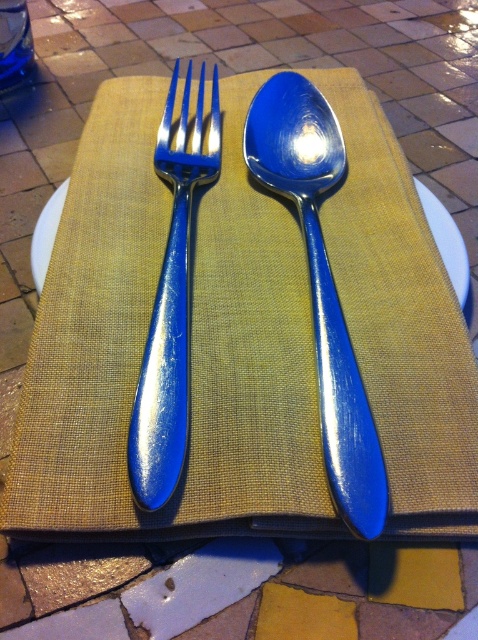
You are setting up a table for a dinner party and need to place a decorative centerpiece between the blue shiny spoon at center and the shiny blue fork at center. Since the table is narrow, you want to know which utensil is wider to ensure the centerpiece fits properly. Which utensil is wider?

The blue shiny spoon at center is wider than the shiny blue fork at center, so the centerpiece should be placed closer to the fork to accommodate the spoon.

You are setting up a table for a dinner party and have a decorative plate that is 30 centimeters wide. You want to place the blue shiny spoon at center on it. Will the spoon fit on the plate?

The blue shiny spoon at center is 38.30 centimeters away from the fork, but the distance between them doesn

From the picture: You are setting the table and need to place a knife between the blue shiny spoon at center and the shiny blue fork at center. Based on their positions, which side of the fork should you place the knife?

The blue shiny spoon at center is to the right of the shiny blue fork at center, so you should place the knife to the right of the shiny blue fork at center between them.